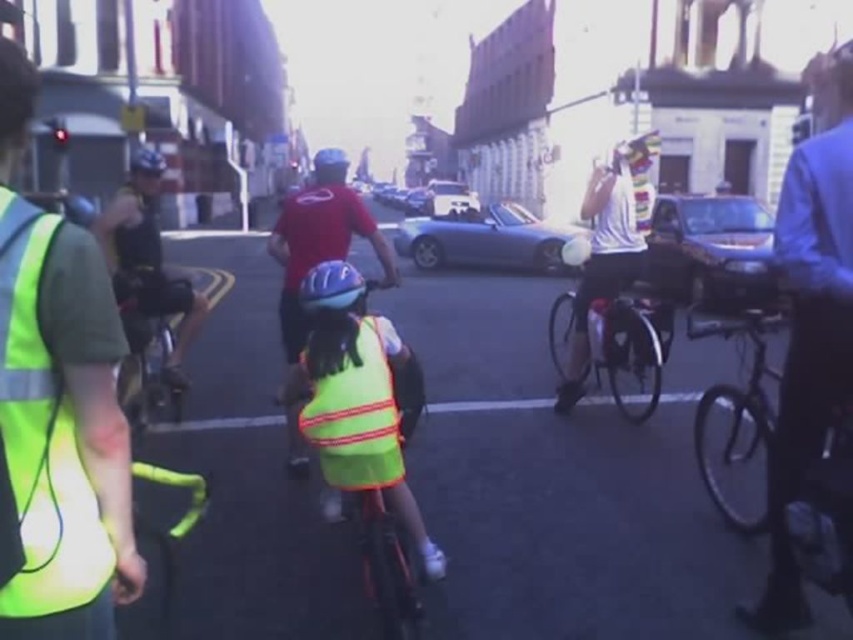
Question: Is shiny metallic bicycle at left further to camera compared to reflective fabric bicycle at center?

Choices:
 (A) no
 (B) yes

Answer: (B)

Question: Which of the following is the closest to the observer?

Choices:
 (A) (103, 243)
 (B) (381, 449)
 (C) (299, 474)

Answer: (B)

Question: Which object is closer to the camera taking this photo?

Choices:
 (A) blue fabric shirt at right
 (B) shiny black bicycle at center
 (C) shiny metallic bicycle at left

Answer: (A)

Question: Is blue fabric shirt at right behind neon yellow reflective safety vest at center?

Choices:
 (A) no
 (B) yes

Answer: (A)

Question: Is matte black helmet at left thinner than blue matte helmet at center?

Choices:
 (A) yes
 (B) no

Answer: (B)

Question: Among these points, which one is farthest from the camera?

Choices:
 (A) (115, 573)
 (B) (595, 337)
 (C) (157, 164)
 (D) (370, 372)

Answer: (B)